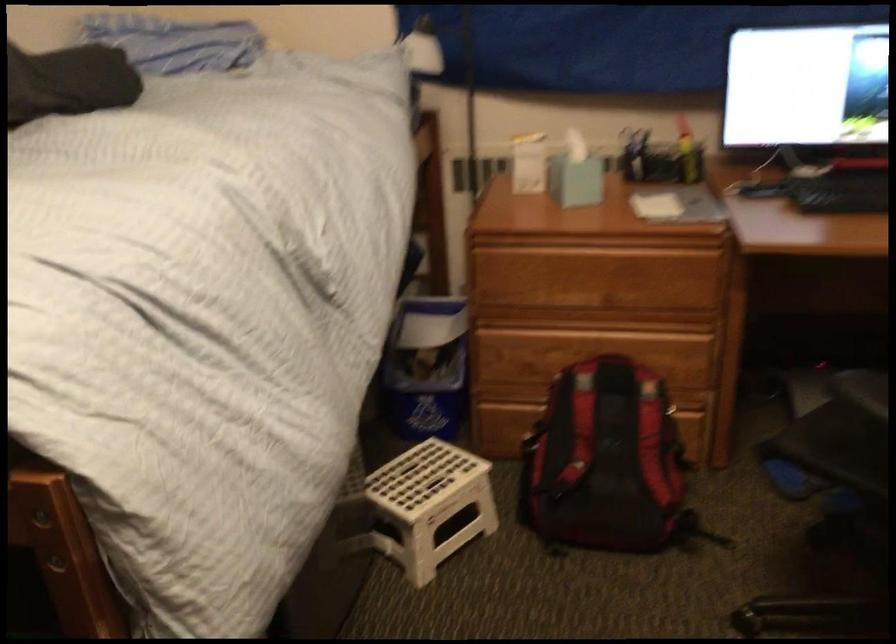
The location [426,368] corresponds to which object?

This point indicates the blue tissue box.